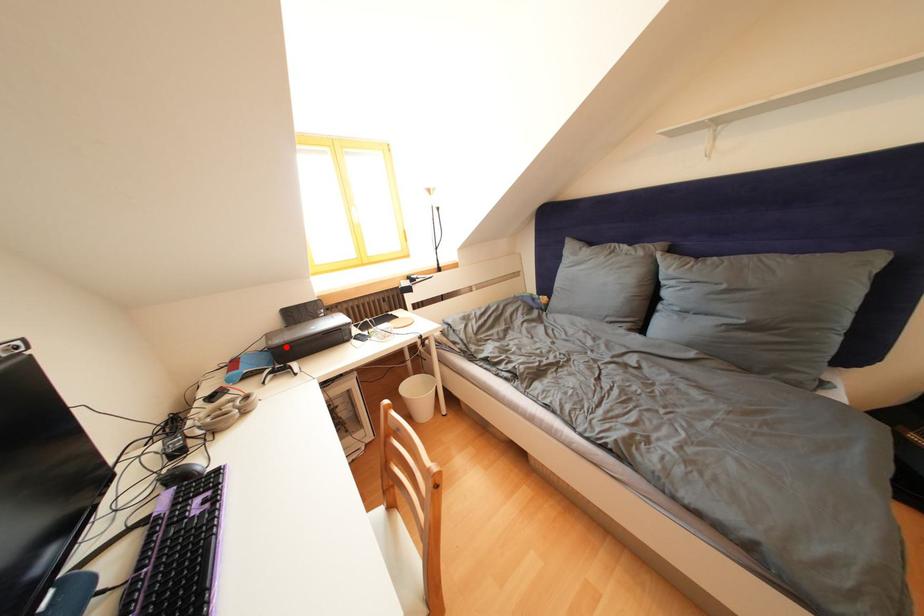
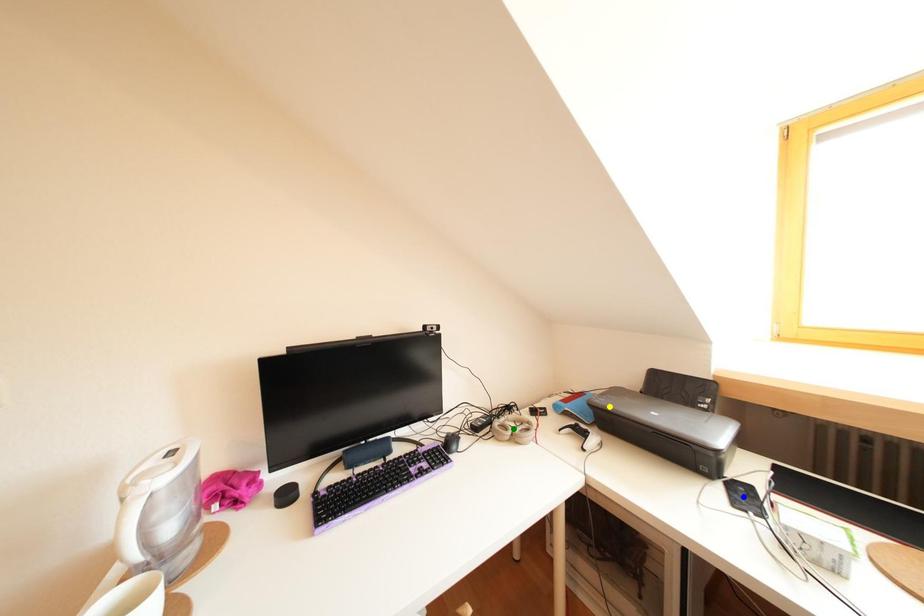
Question: I am providing you with two images of the same scene from different viewpoints. A red point is marked on the first image. You are given multiple points on the second image. Which spot in image 2 lines up with the point in image 1?

Choices:
 (A) yellow point
 (B) blue point
 (C) green point

Answer: (A)